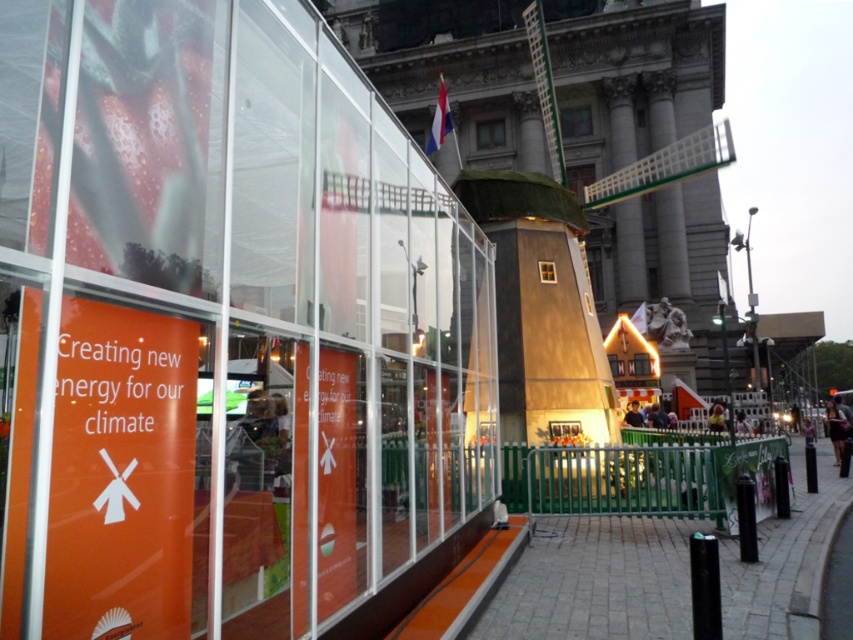
Is orange matte sign at lower left closer to the viewer compared to wooden windmill at center?

Yes, it is.

The width and height of the screenshot is (853, 640). Identify the location of orange matte sign at lower left. (120, 476).

Identify the location of orange matte sign at lower left. (120, 476).

Can you confirm if paved stone pavement at center is wider than wooden windmill at center?

Yes, paved stone pavement at center is wider than wooden windmill at center.

Between point (654, 588) and point (511, 300), which one is positioned behind?

The point (511, 300) is behind.

Describe the element at coordinates (596, 580) in the screenshot. This screenshot has height=640, width=853. I see `paved stone pavement at center` at that location.

Identify the location of paved stone pavement at center. The height and width of the screenshot is (640, 853). (596, 580).

Which is below, orange matte sign at lower left or paved stone pavement at center?

paved stone pavement at center is lower down.

Can you confirm if orange matte sign at lower left is taller than paved stone pavement at center?

Yes, orange matte sign at lower left is taller than paved stone pavement at center.

Which is behind, point (80, 500) or point (730, 557)?

Point (730, 557)

Locate an element on the screen. orange matte sign at lower left is located at coordinates (120, 476).